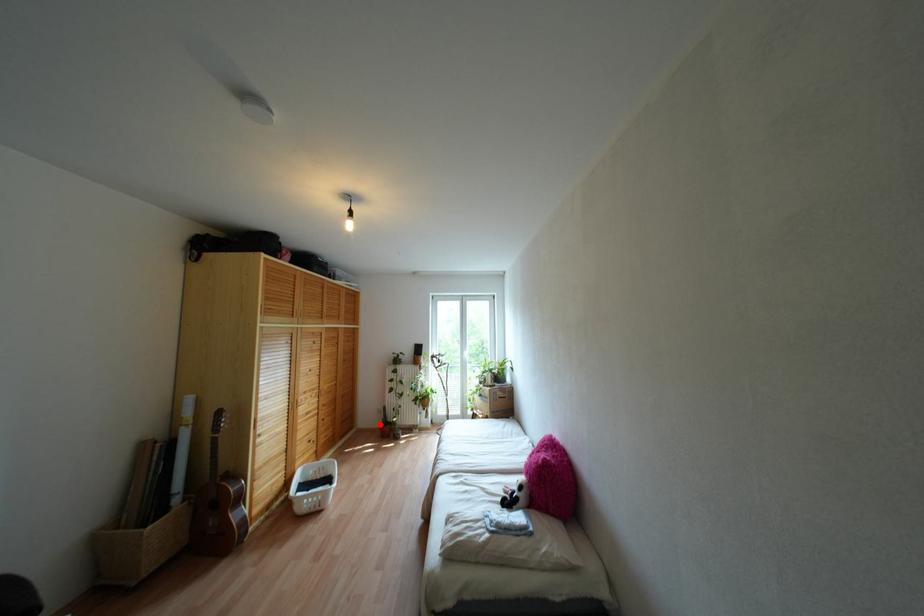
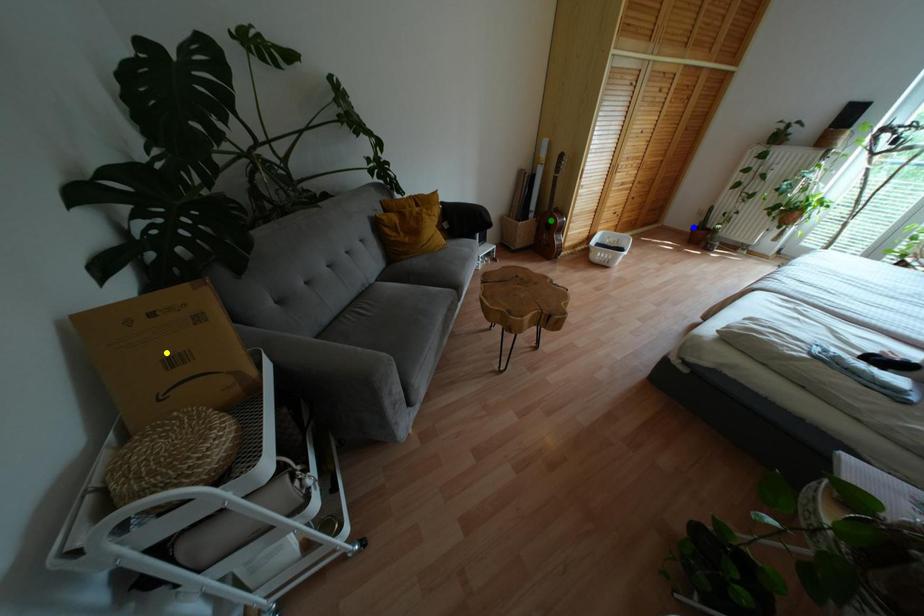
Question: I am providing you with two images of the same scene from different viewpoints. A red point is marked on the first image. You are given multiple points on the second image. Which point in image 2 represents the same 3d spot as the red point in image 1?

Choices:
 (A) blue point
 (B) green point
 (C) yellow point

Answer: (A)